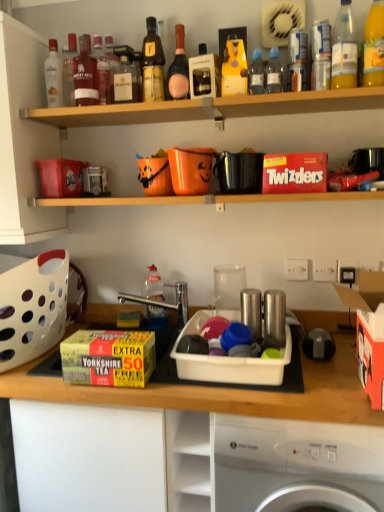
Question: From the image's perspective, would you say pink glass bottle at upper center, which is the 6th bottle in left-to-right order, is shown under translucent plastic bottle at upper right, the 12th bottle when ordered from left to right?

Choices:
 (A) yes
 (B) no

Answer: (B)

Question: Is pink glass bottle at upper center, which is the 6th bottle in left-to-right order, positioned with its back to translucent plastic bottle at upper right, which is the first bottle in right-to-left order?

Choices:
 (A) no
 (B) yes

Answer: (A)

Question: Does pink glass bottle at upper center, arranged as the seventh bottle when viewed from the right, come behind translucent plastic bottle at upper right, which is the first bottle in right-to-left order?

Choices:
 (A) no
 (B) yes

Answer: (B)

Question: From a real-world perspective, is pink glass bottle at upper center, arranged as the seventh bottle when viewed from the right, positioned over translucent plastic bottle at upper right, which is the first bottle in right-to-left order, based on gravity?

Choices:
 (A) no
 (B) yes

Answer: (A)

Question: From the image's perspective, is pink glass bottle at upper center, which is the 6th bottle in left-to-right order, on top of translucent plastic bottle at upper right, the 12th bottle when ordered from left to right?

Choices:
 (A) yes
 (B) no

Answer: (A)

Question: Do you think transparent plastic bottle at center, which is the fourth bottle in left-to-right order, is within yellow cardboard box at center, which appears as the second box when viewed from the right, or outside of it?

Choices:
 (A) inside
 (B) outside

Answer: (B)

Question: From a real-world perspective, is transparent plastic bottle at center, which is the fourth bottle in left-to-right order, positioned above or below yellow cardboard box at center, which is the 1th box from bottom to top?

Choices:
 (A) below
 (B) above

Answer: (B)

Question: Considering the positions of point (147, 315) and point (137, 373), is point (147, 315) closer or farther from the camera than point (137, 373)?

Choices:
 (A) closer
 (B) farther

Answer: (B)

Question: Based on their sizes in the image, would you say transparent plastic bottle at center, which is the fourth bottle in left-to-right order, is bigger or smaller than yellow cardboard box at center, which is the 3th box from top to bottom?

Choices:
 (A) big
 (B) small

Answer: (B)

Question: In the image, is transparent plastic bottle at upper center, acting as the 5th bottle starting from the right, positioned in front of or behind matte glass whisky bottle at upper left, which is the eleventh bottle in right-to-left order?

Choices:
 (A) behind
 (B) front

Answer: (B)

Question: Is transparent plastic bottle at upper center, acting as the 5th bottle starting from the right, taller or shorter than matte glass whisky bottle at upper left, which is the eleventh bottle in right-to-left order?

Choices:
 (A) short
 (B) tall

Answer: (A)

Question: From the image's perspective, relative to matte glass whisky bottle at upper left, which ranks as the second bottle in left-to-right order, is transparent plastic bottle at upper center, the 8th bottle from the left, above or below?

Choices:
 (A) below
 (B) above

Answer: (A)

Question: Looking at their shapes, would you say transparent plastic bottle at upper center, acting as the 5th bottle starting from the right, is wider or thinner than matte glass whisky bottle at upper left, which ranks as the second bottle in left-to-right order?

Choices:
 (A) thin
 (B) wide

Answer: (A)

Question: From the image's perspective, relative to transparent plastic bottle at upper center, placed as the 9th bottle when sorted from left to right, is matte glass bottle at upper left, the first bottle when ordered from left to right, above or below?

Choices:
 (A) above
 (B) below

Answer: (A)

Question: From a real-world perspective, is matte glass bottle at upper left, the first bottle when ordered from left to right, positioned above or below transparent plastic bottle at upper center, acting as the fourth bottle starting from the right?

Choices:
 (A) below
 (B) above

Answer: (B)